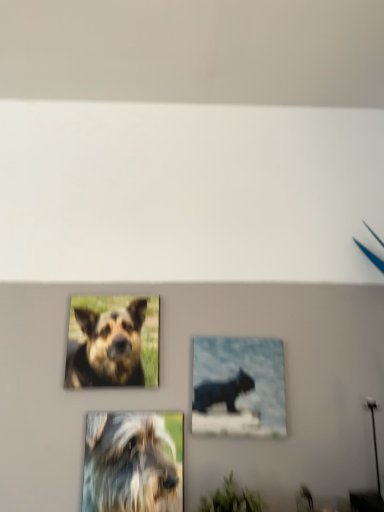
Question: Is green matte plant at lower center oriented towards matte black cat at center?

Choices:
 (A) yes
 (B) no

Answer: (B)

Question: Considering the relative sizes of green matte plant at lower center and matte black cat at center in the image provided, is green matte plant at lower center bigger than matte black cat at center?

Choices:
 (A) yes
 (B) no

Answer: (A)

Question: Can you confirm if green matte plant at lower center is thinner than matte black cat at center?

Choices:
 (A) yes
 (B) no

Answer: (B)

Question: Does green matte plant at lower center come in front of matte black cat at center?

Choices:
 (A) yes
 (B) no

Answer: (A)

Question: Could matte black cat at center be considered to be inside green matte plant at lower center?

Choices:
 (A) yes
 (B) no

Answer: (B)

Question: Considering the positions of point (241, 421) and point (173, 505), is point (241, 421) closer or farther from the camera than point (173, 505)?

Choices:
 (A) farther
 (B) closer

Answer: (A)

Question: Looking at their shapes, would you say matte black cat at center is wider or thinner than fuzzy fur dog at center, which is the second dog from top to bottom?

Choices:
 (A) thin
 (B) wide

Answer: (B)

Question: Is matte black cat at center taller or shorter than fuzzy fur dog at center, the 2th dog viewed from the back?

Choices:
 (A) tall
 (B) short

Answer: (A)

Question: In terms of size, does matte black cat at center appear bigger or smaller than fuzzy fur dog at center, which is the second dog from top to bottom?

Choices:
 (A) small
 (B) big

Answer: (B)

Question: Looking at their shapes, would you say green matte plant at lower center is wider or thinner than fuzzy fur dog at center, the first dog positioned from the front?

Choices:
 (A) wide
 (B) thin

Answer: (A)

Question: In terms of height, does green matte plant at lower center look taller or shorter compared to fuzzy fur dog at center, the first dog ordered from the bottom?

Choices:
 (A) short
 (B) tall

Answer: (A)

Question: Choose the correct answer: Is green matte plant at lower center inside fuzzy fur dog at center, the 2th dog viewed from the back, or outside it?

Choices:
 (A) outside
 (B) inside

Answer: (A)

Question: Based on their sizes in the image, would you say green matte plant at lower center is bigger or smaller than fuzzy fur dog at center, the first dog positioned from the front?

Choices:
 (A) small
 (B) big

Answer: (B)

Question: Is point (203, 360) positioned closer to the camera than point (258, 501)?

Choices:
 (A) closer
 (B) farther

Answer: (B)

Question: In terms of width, does matte black cat at center look wider or thinner when compared to green matte plant at lower center?

Choices:
 (A) thin
 (B) wide

Answer: (A)